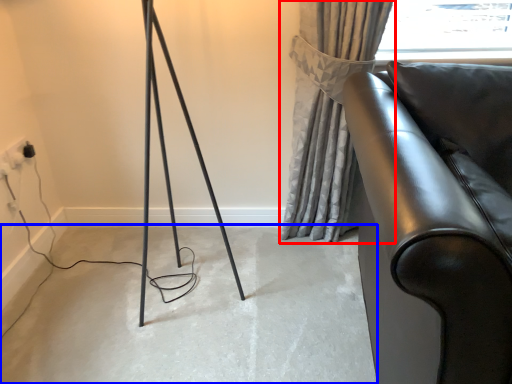
Question: Which object is closer to the camera taking this photo, curtain (highlighted by a red box) or concrete (highlighted by a blue box)?

Choices:
 (A) curtain
 (B) concrete

Answer: (B)